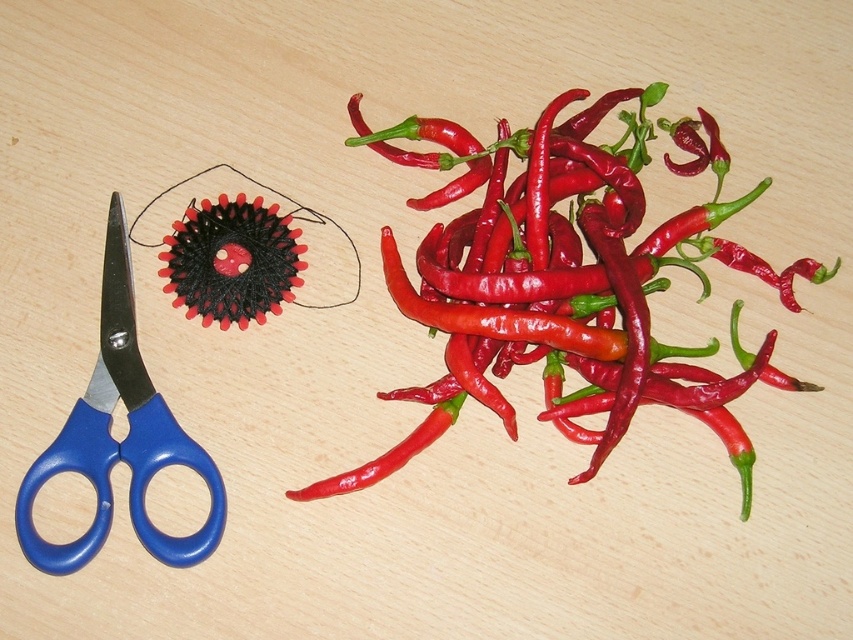
You are a chef preparing a dish and need to choose between the smooth red chili peppers at upper right and the blue plastic scissors at left. Which item is bigger in size?

The smooth red chili peppers at upper right are larger in size than the blue plastic scissors at left.

You are a chef preparing to chop some chilies. You see the smooth red chili peppers at upper right and the blue plastic scissors at left. Which object is closer to you?

The blue plastic scissors at left are closer to you than the smooth red chili peppers at upper right because the distance between them is 16.24 inches, so the scissors are nearer.

You are organizing items on a table and need to place a new object between the smooth red chili peppers at upper right and the blue plastic scissors at left. Can you do this without moving the existing items?

The blue plastic scissors at left is behind the smooth red chili peppers at upper right, so there is no space between them to place a new object without moving the existing items.